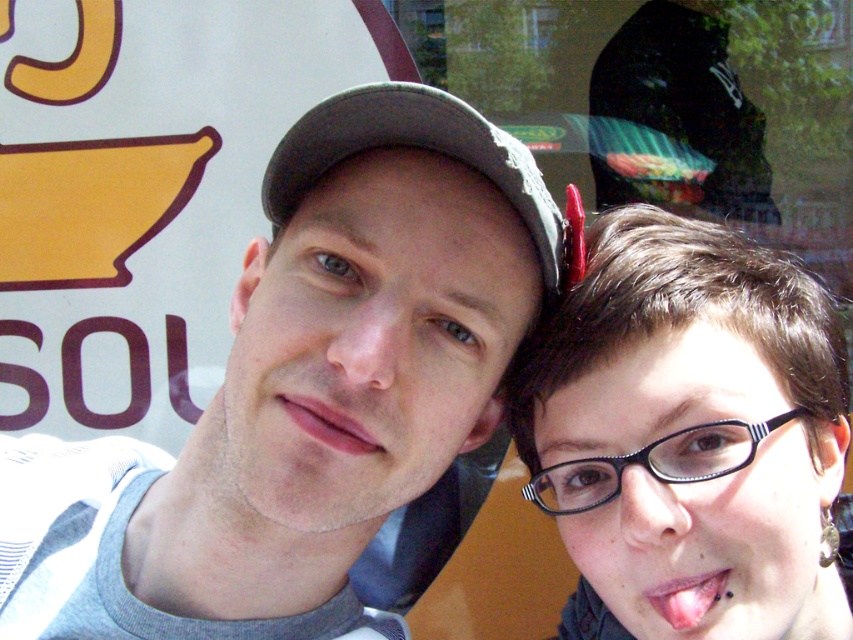
Question: Does gray fabric baseball cap at upper center appear under pink matte lips at center?

Choices:
 (A) yes
 (B) no

Answer: (B)

Question: Among these points, which one is nearest to the camera?

Choices:
 (A) (674, 307)
 (B) (527, 166)
 (C) (677, 604)
 (D) (367, 435)

Answer: (B)

Question: Does pink matte lips at center have a lesser width compared to pink flesh at center?

Choices:
 (A) yes
 (B) no

Answer: (B)

Question: Which of the following is the closest to the observer?

Choices:
 (A) (502, 369)
 (B) (654, 291)
 (C) (309, 403)
 (D) (692, 596)

Answer: (C)

Question: Which point is farther to the camera?

Choices:
 (A) (680, 616)
 (B) (270, 525)

Answer: (B)

Question: Is gray fabric cap at upper center above pink flesh at center?

Choices:
 (A) yes
 (B) no

Answer: (A)